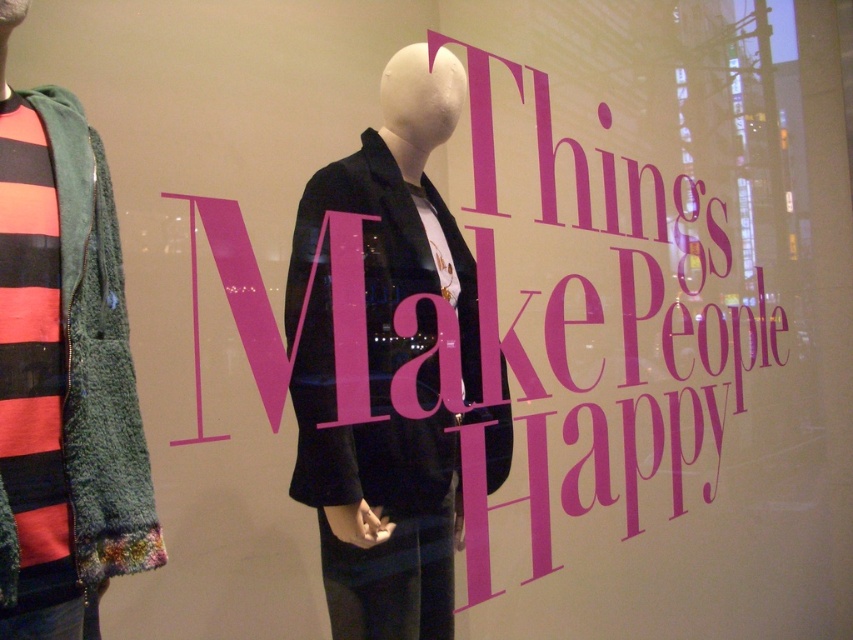
Question: Which object appears farthest from the camera in this image?

Choices:
 (A) matte black jacket at center
 (B) green fuzzy jacket at left
 (C) pink paper at center

Answer: (C)

Question: Observing the image, what is the correct spatial positioning of matte black jacket at center in reference to green fuzzy jacket at left?

Choices:
 (A) left
 (B) right

Answer: (B)

Question: Is pink paper at center further to the viewer compared to matte black jacket at center?

Choices:
 (A) no
 (B) yes

Answer: (B)

Question: Estimate the real-world distances between objects in this image. Which object is farther from the green fuzzy jacket at left?

Choices:
 (A) matte black jacket at center
 (B) pink paper at center

Answer: (B)

Question: Does matte black jacket at center have a greater width compared to green fuzzy jacket at left?

Choices:
 (A) yes
 (B) no

Answer: (A)

Question: Considering the real-world distances, which object is farthest from the matte black jacket at center?

Choices:
 (A) green fuzzy jacket at left
 (B) pink paper at center

Answer: (B)